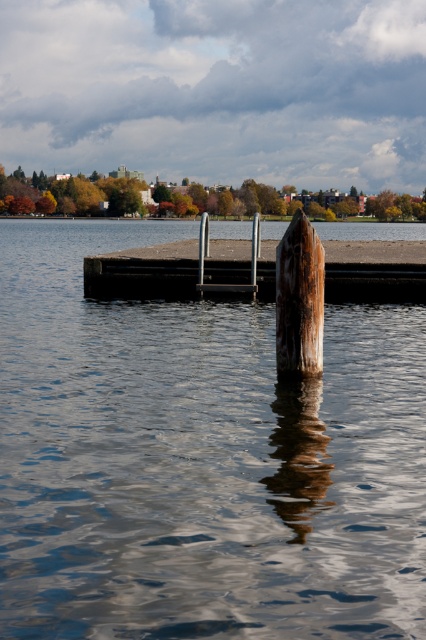
You are standing on the wooden dock at center and want to step onto the rusty wood post at center. Based on their heights, is this possible without jumping?

The wooden dock at center is taller than the rusty wood post at center, so stepping onto it would require jumping or descending since the dock is higher.

You are standing at the wooden post in the water and want to walk to the point at coordinates (374,269). Is there a clear path from the wooden post to the point on the wooden dock at center?

The point at coordinates (374,269) is on the wooden dock at center, so yes, there is a clear path from the wooden post to the point on the wooden dock at center as they are both part of the dock structure.

You are standing at the lakeside and want to step onto the concrete platform. You see the smooth dark water at center and the rusty wood post at center. Which object is closer to you as you approach the platform?

The smooth dark water at center is closer to the viewer than the rusty wood post at center, so the smooth dark water at center is closer to you as you approach the platform.